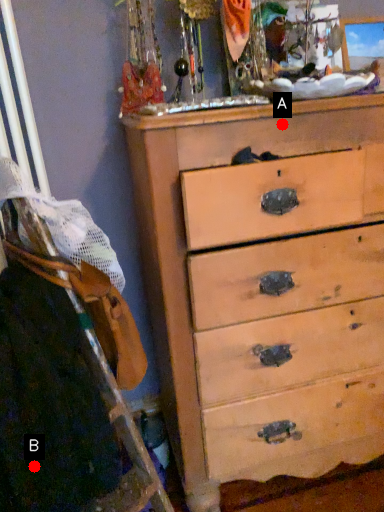
Question: Two points are circled on the image, labeled by A and B beside each circle. Which point is further to the camera?

Choices:
 (A) A is further
 (B) B is further

Answer: (A)